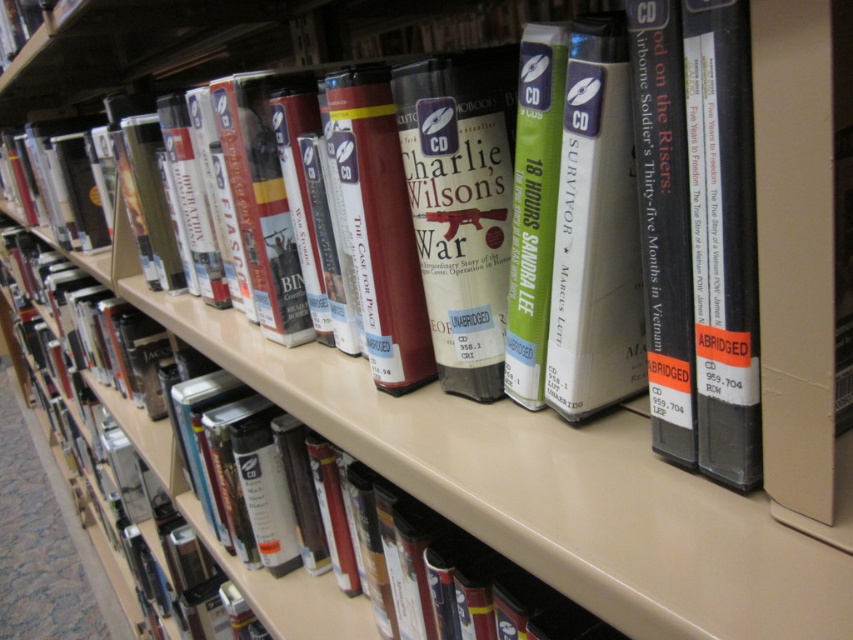
Question: Which point is farther to the camera?

Choices:
 (A) (614, 198)
 (B) (749, 228)

Answer: (A)

Question: Is matte gray cd at center to the left of black hardcover book at center from the viewer's perspective?

Choices:
 (A) yes
 (B) no

Answer: (A)

Question: From the image, what is the correct spatial relationship of matte gray cd at center in relation to black hardcover book at center?

Choices:
 (A) right
 (B) left

Answer: (B)

Question: Which of the following is the closest to the observer?

Choices:
 (A) matte gray cd at center
 (B) black hardcover book at center

Answer: (B)

Question: Which object is closer to the camera taking this photo?

Choices:
 (A) black hardcover book at center
 (B) matte gray cd at center

Answer: (A)

Question: Does matte gray cd at center appear over black hardcover book at center?

Choices:
 (A) yes
 (B) no

Answer: (A)